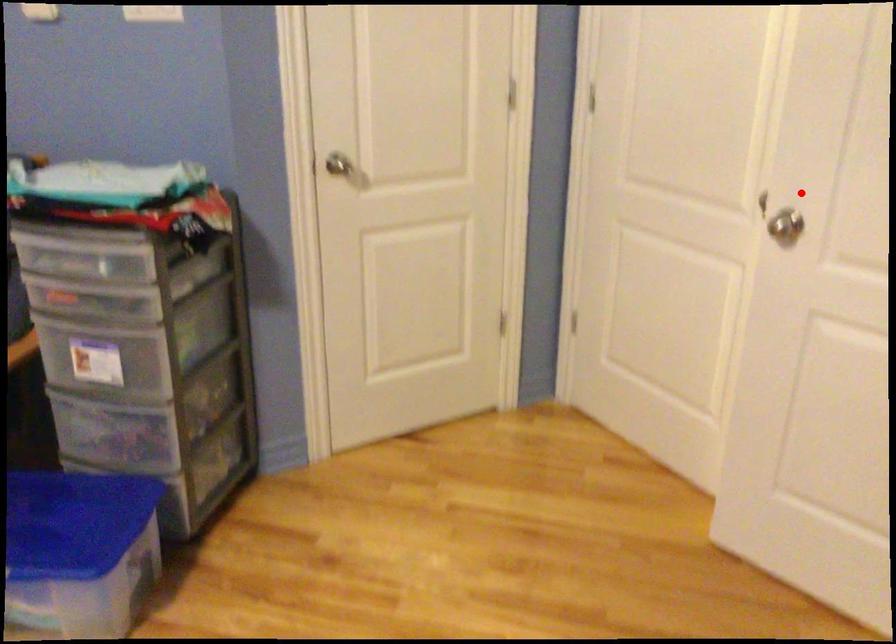
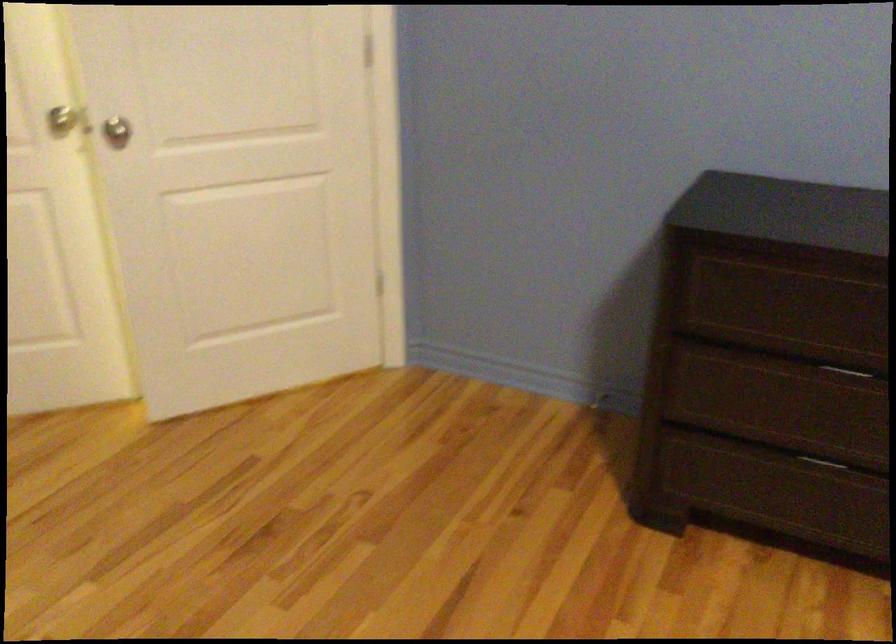
Question: I am providing you with two images of the same scene from different viewpoints. In image1, a red point is highlighted. Considering the same 3D point in image2, which of the following is correct?

Choices:
 (A) It is closer
 (B) It is farther

Answer: (B)